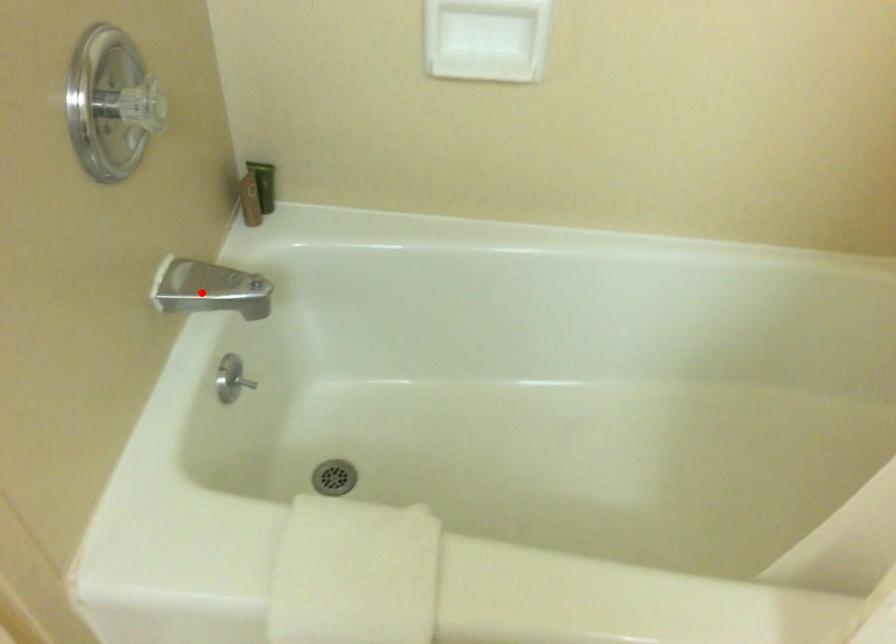
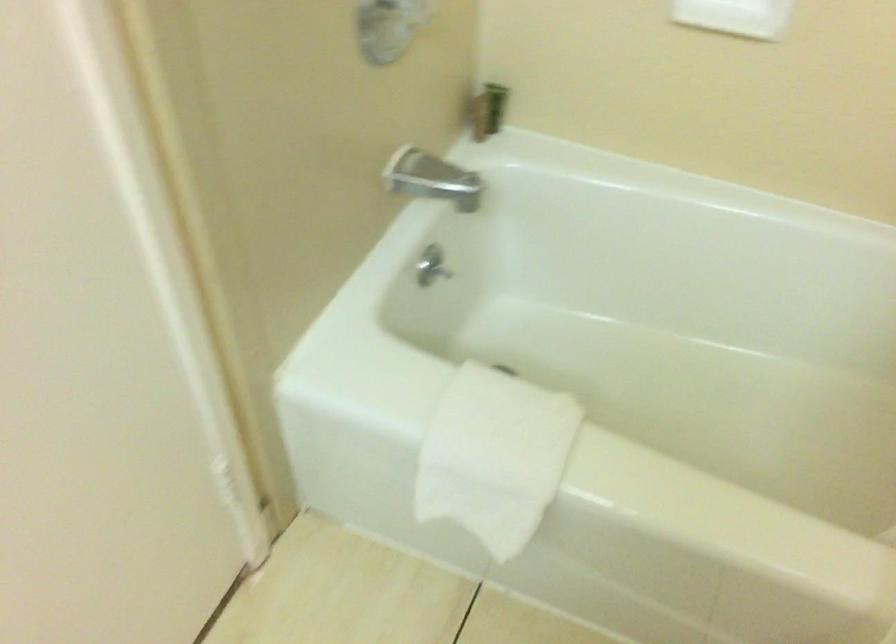
Where in the second image is the point corresponding to the highlighted location from the first image?

(424, 176)